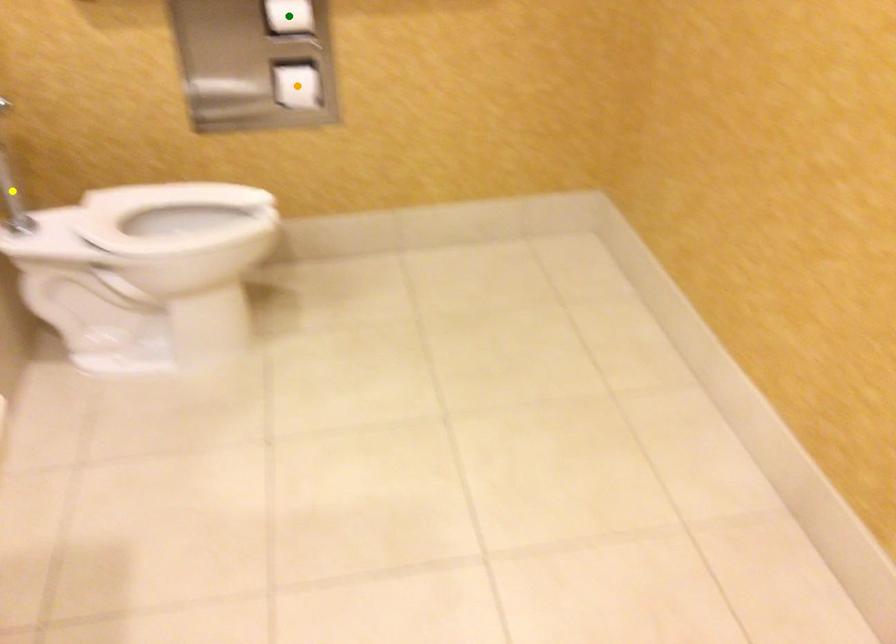
Order these from farthest to nearest:
1. orange point
2. green point
3. yellow point

orange point → yellow point → green point